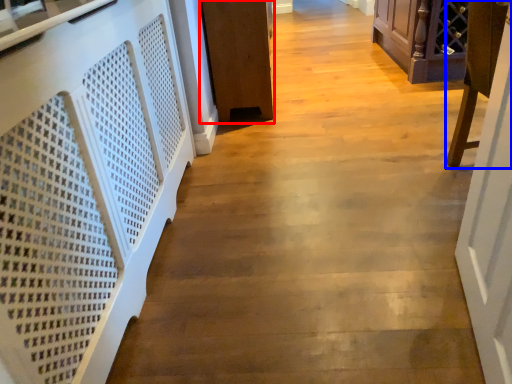
Question: Among these objects, which one is nearest to the camera, furniture (highlighted by a red box) or furniture (highlighted by a blue box)?

Choices:
 (A) furniture
 (B) furniture

Answer: (B)